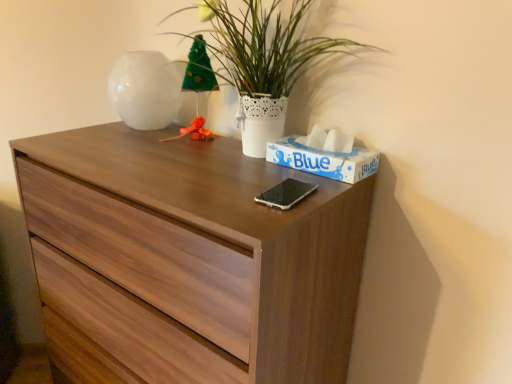
Where is `vacant space in front of white glossy vase at upper left`? The image size is (512, 384). vacant space in front of white glossy vase at upper left is located at coordinates (117, 145).